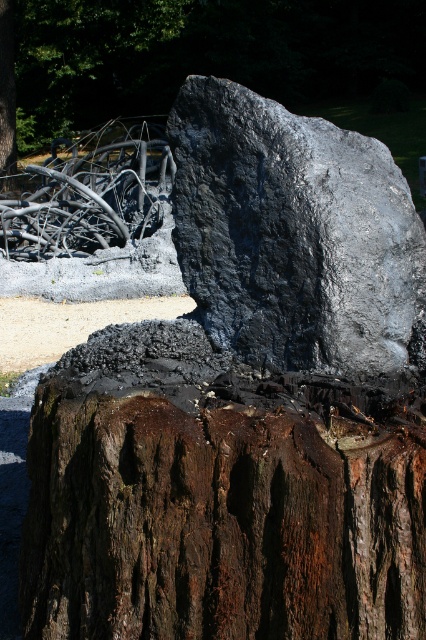
Can you confirm if rusty wood tree trunk at center is positioned to the right of brown rough tree trunk at center?

Yes, rusty wood tree trunk at center is to the right of brown rough tree trunk at center.

How far apart are rusty wood tree trunk at center and brown rough tree trunk at center?

13.65 meters

Find the location of a particular element. The image size is (426, 640). rusty wood tree trunk at center is located at coordinates (221, 522).

Who is more distant from viewer, (x=256, y=205) or (x=2, y=188)?

The point (x=2, y=188) is behind.

Find the location of a particular element. black polished rock at center is located at coordinates (293, 234).

I want to click on black polished rock at center, so click(x=293, y=234).

Is rusty wood tree trunk at center closer to camera compared to black polished rock at center?

Yes, it is in front of black polished rock at center.

Is point (293, 504) in front of point (181, 184)?

Yes, it is.

Image resolution: width=426 pixels, height=640 pixels. Identify the location of rusty wood tree trunk at center. (221, 522).